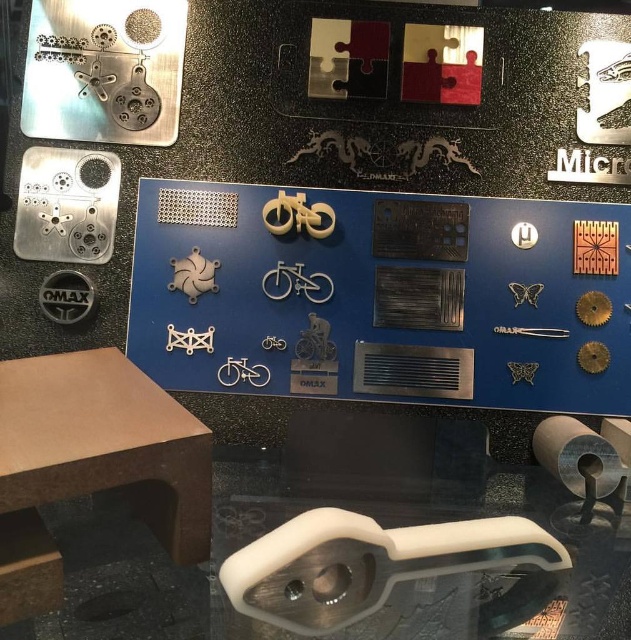
Question: Is transparent plastic handle at lower center to the right of brown matte table at lower left from the viewer's perspective?

Choices:
 (A) no
 (B) yes

Answer: (B)

Question: Which point appears farthest from the camera in this image?

Choices:
 (A) (85, 596)
 (B) (158, 429)

Answer: (B)

Question: Which point appears closest to the camera in this image?

Choices:
 (A) (165, 524)
 (B) (62, 509)

Answer: (A)

Question: Considering the relative positions of transparent plastic handle at lower center and brown matte table at lower left in the image provided, where is transparent plastic handle at lower center located with respect to brown matte table at lower left?

Choices:
 (A) right
 (B) left

Answer: (A)

Question: Which point is closer to the camera?

Choices:
 (A) (54, 534)
 (B) (80, 417)

Answer: (B)

Question: Is transparent plastic handle at lower center below brown matte table at lower left?

Choices:
 (A) yes
 (B) no

Answer: (A)